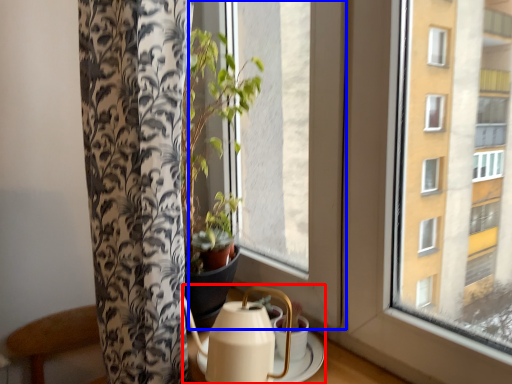
Question: Which object appears closest to the camera in this image, tea set (highlighted by a red box) or window (highlighted by a blue box)?

Choices:
 (A) tea set
 (B) window

Answer: (A)